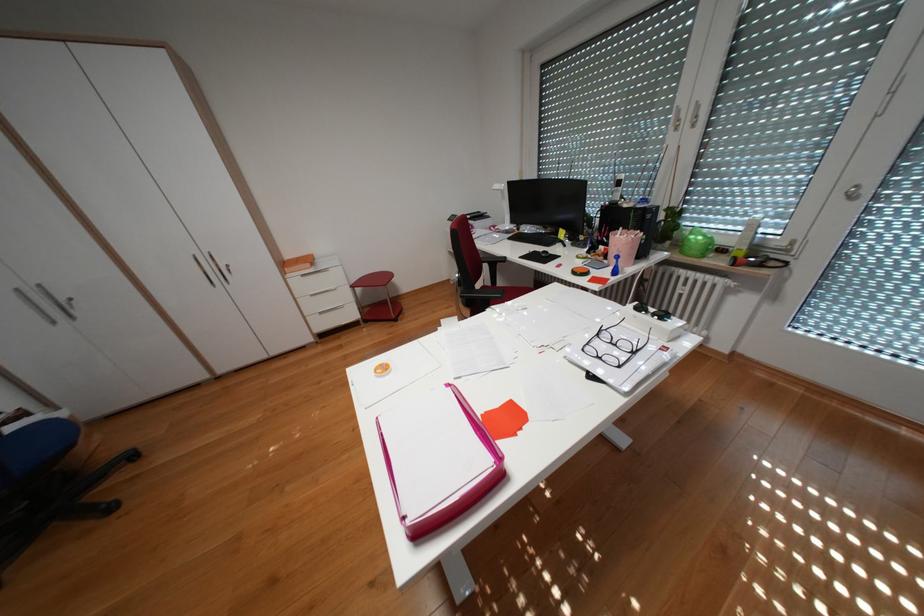
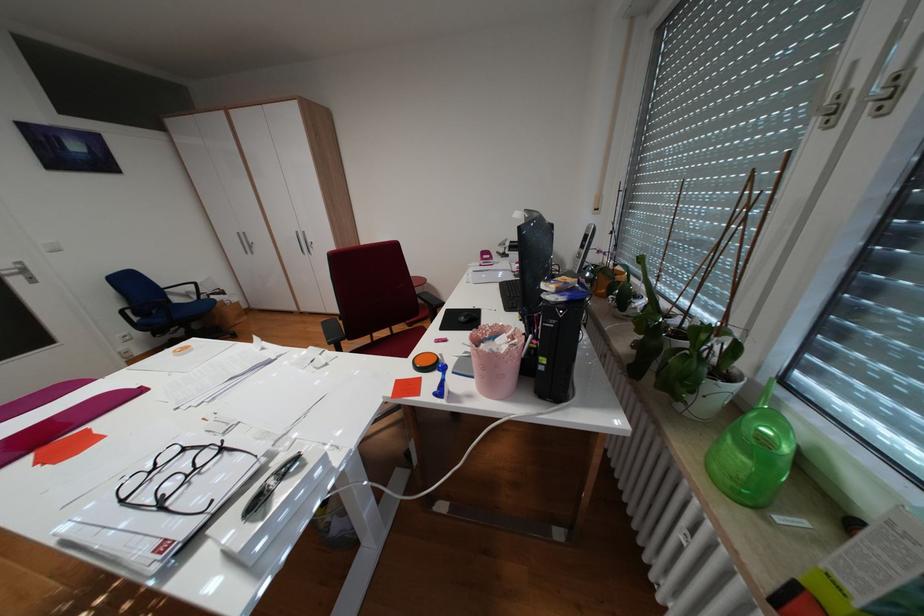
Find the pixel in the second image that matches [672,246] in the first image.

(691, 405)